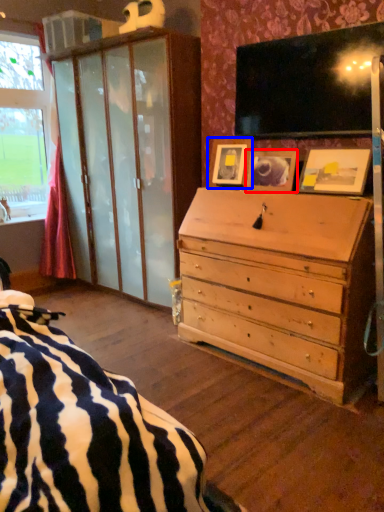
Question: Which of the following is the farthest to the observer, picture frame (highlighted by a red box) or picture frame (highlighted by a blue box)?

Choices:
 (A) picture frame
 (B) picture frame

Answer: (B)